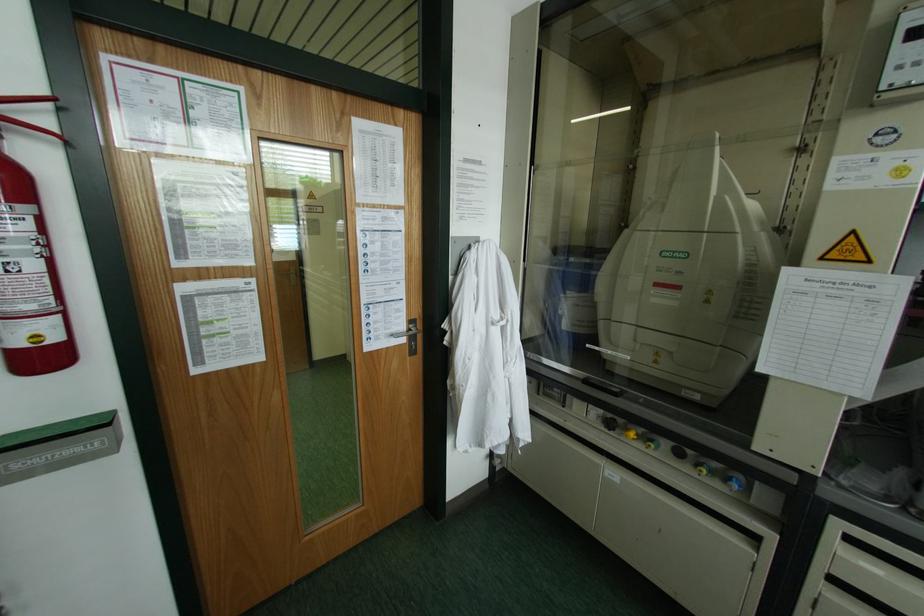
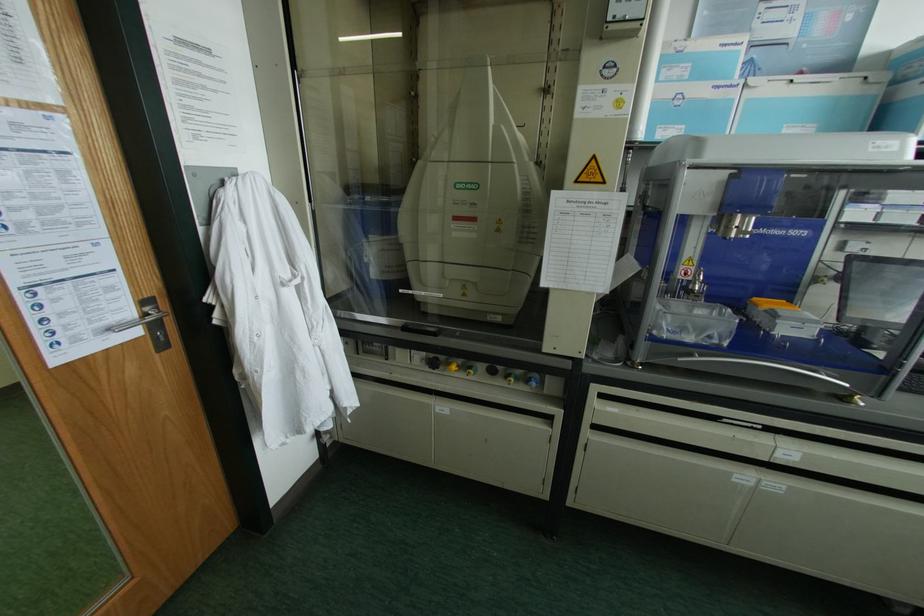
Question: The camera is either moving clockwise (left) or counter-clockwise (right) around the object. The first image is from the beginning of the video and the second image is from the end. Is the camera moving left or right when shooting the video?

Choices:
 (A) Left
 (B) Right

Answer: (A)